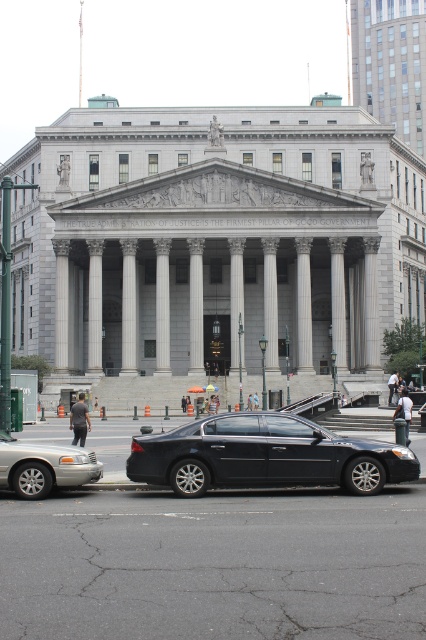
Is shiny black sedan at center further to camera compared to silver metallic sedan at lower left?

Yes, it is.

Between point (310, 428) and point (48, 460), which one is positioned behind?

Positioned behind is point (310, 428).

Where is `shiny black sedan at center`? This screenshot has width=426, height=640. shiny black sedan at center is located at coordinates coord(265,456).